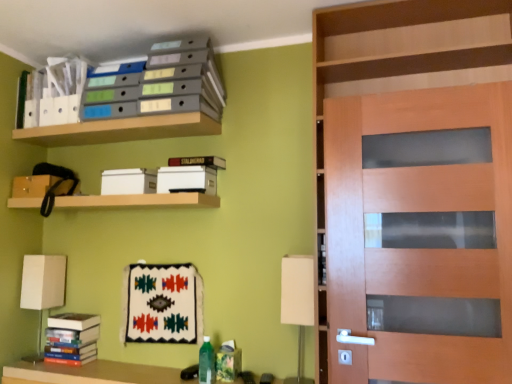
Question: From the image's perspective, is wooden door at right below white fabric table lamp at lower left, placed as the second table lamp when sorted from front to back?

Choices:
 (A) no
 (B) yes

Answer: (A)

Question: Is wooden door at right with white fabric table lamp at lower left, marked as the 1th table lamp in a left-to-right arrangement?

Choices:
 (A) no
 (B) yes

Answer: (A)

Question: Is wooden door at right at the right side of white fabric table lamp at lower left, marked as the 1th table lamp in a left-to-right arrangement?

Choices:
 (A) yes
 (B) no

Answer: (A)

Question: Does wooden door at right have a lesser height compared to white fabric table lamp at lower left, marked as the 2th table lamp in a right-to-left arrangement?

Choices:
 (A) no
 (B) yes

Answer: (A)

Question: Considering the relative sizes of wooden door at right and white fabric table lamp at lower left, placed as the second table lamp when sorted from front to back, in the image provided, is wooden door at right smaller than white fabric table lamp at lower left, placed as the second table lamp when sorted from front to back,?

Choices:
 (A) no
 (B) yes

Answer: (A)

Question: From the image's perspective, is wooden shelf at upper center, the second shelf positioned from the bottom, above or below wooden shelf at upper center, which is counted as the first shelf, starting from the bottom?

Choices:
 (A) below
 (B) above

Answer: (B)

Question: Is wooden shelf at upper center, marked as the 2th shelf in a top-to-bottom arrangement, wider or thinner than wooden shelf at upper center, acting as the 3th shelf starting from the top?

Choices:
 (A) wide
 (B) thin

Answer: (B)

Question: Is wooden shelf at upper center, the second shelf positioned from the bottom, inside or outside of wooden shelf at upper center, which is counted as the first shelf, starting from the bottom?

Choices:
 (A) outside
 (B) inside

Answer: (A)

Question: Considering the positions of wooden shelf at upper center, the second shelf positioned from the bottom, and wooden shelf at upper center, acting as the 3th shelf starting from the top, in the image, is wooden shelf at upper center, the second shelf positioned from the bottom, bigger or smaller than wooden shelf at upper center, acting as the 3th shelf starting from the top,?

Choices:
 (A) small
 (B) big

Answer: (A)

Question: Would you say hardcover book at upper center, the second book from the left, is inside or outside wooden shelf at upper center, the second shelf positioned from the bottom?

Choices:
 (A) outside
 (B) inside

Answer: (A)

Question: Is hardcover book at upper center, the second book from the left, wider or thinner than wooden shelf at upper center, the second shelf positioned from the bottom?

Choices:
 (A) wide
 (B) thin

Answer: (B)

Question: From the image's perspective, relative to wooden shelf at upper center, marked as the 2th shelf in a top-to-bottom arrangement, is hardcover book at upper center, which appears as the first book when viewed from the top, above or below?

Choices:
 (A) above
 (B) below

Answer: (B)

Question: Considering the positions of hardcover book at upper center, the second book from the left, and wooden shelf at upper center, the second shelf positioned from the bottom, in the image, is hardcover book at upper center, the second book from the left, bigger or smaller than wooden shelf at upper center, the second shelf positioned from the bottom,?

Choices:
 (A) small
 (B) big

Answer: (A)

Question: Which is correct: white fabric lampshade at lower right, the 2th table lamp positioned from the back, is inside wooden door at right, or outside of it?

Choices:
 (A) inside
 (B) outside

Answer: (B)

Question: Is white fabric lampshade at lower right, which is counted as the first table lamp, starting from the right, to the left or to the right of wooden door at right in the image?

Choices:
 (A) right
 (B) left

Answer: (B)